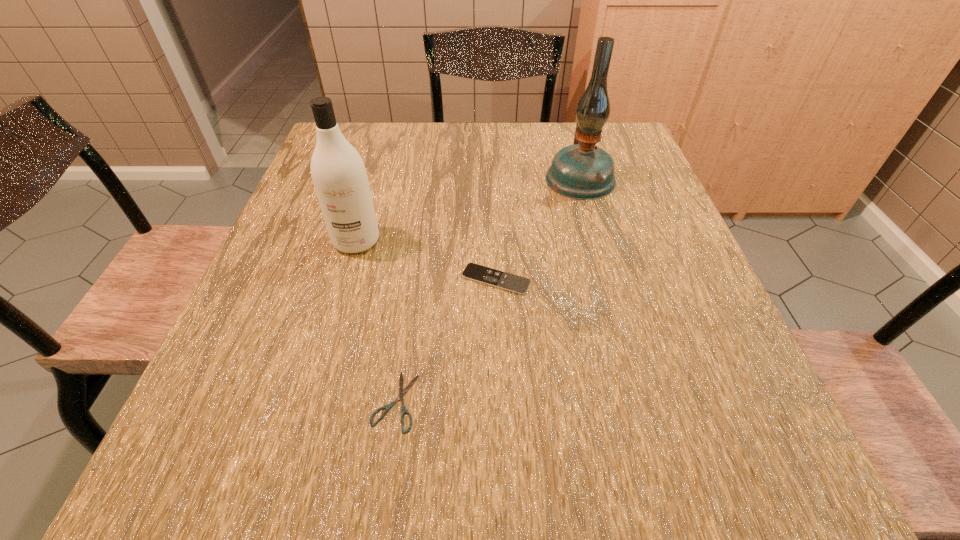
At what (x,y) coordinates should I click in order to perform the action: click on empty space between the farthest object and the third nearest object. Please return your answer as a coordinate pair (x, y). The width and height of the screenshot is (960, 540). Looking at the image, I should click on (468, 210).

Where is `the third closest object relative to the remote control`? the third closest object relative to the remote control is located at coordinates [583, 171].

Where is `object that is the closest to the leftmost object`? object that is the closest to the leftmost object is located at coordinates (475, 272).

Identify the location of vacant space that satisfies the following two spatial constraints: 1. on the front-facing side of the third nearest object; 2. on the left side of the third object from right to left. The height and width of the screenshot is (540, 960). (309, 401).

This screenshot has height=540, width=960. Find the location of `vacant space that satisfies the following two spatial constraints: 1. on the back side of the remote control; 2. on the left side of the shears`. vacant space that satisfies the following two spatial constraints: 1. on the back side of the remote control; 2. on the left side of the shears is located at coordinates (413, 280).

What are the coordinates of `blank space that satisfies the following two spatial constraints: 1. on the front-facing side of the nearest object; 2. on the left side of the third nearest object` in the screenshot? It's located at (309, 401).